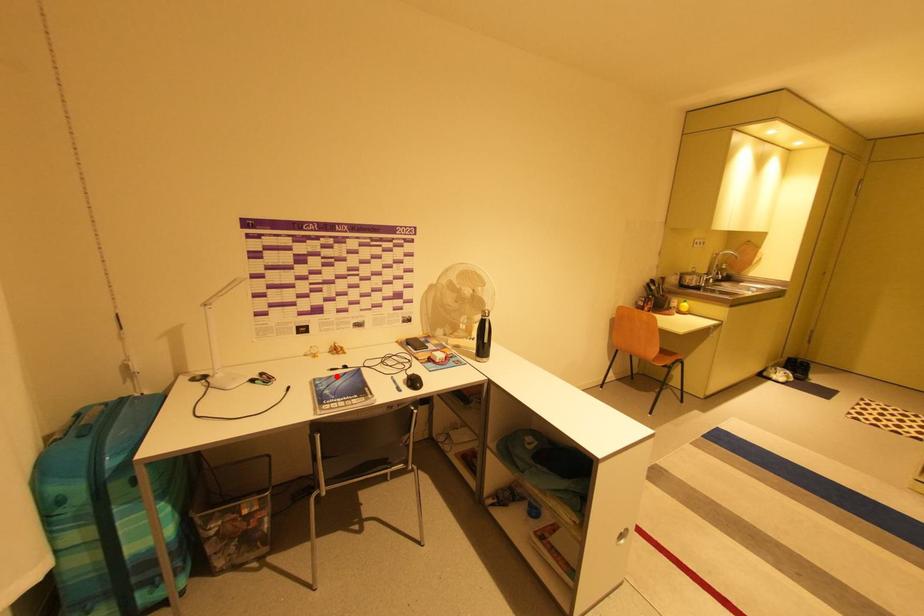
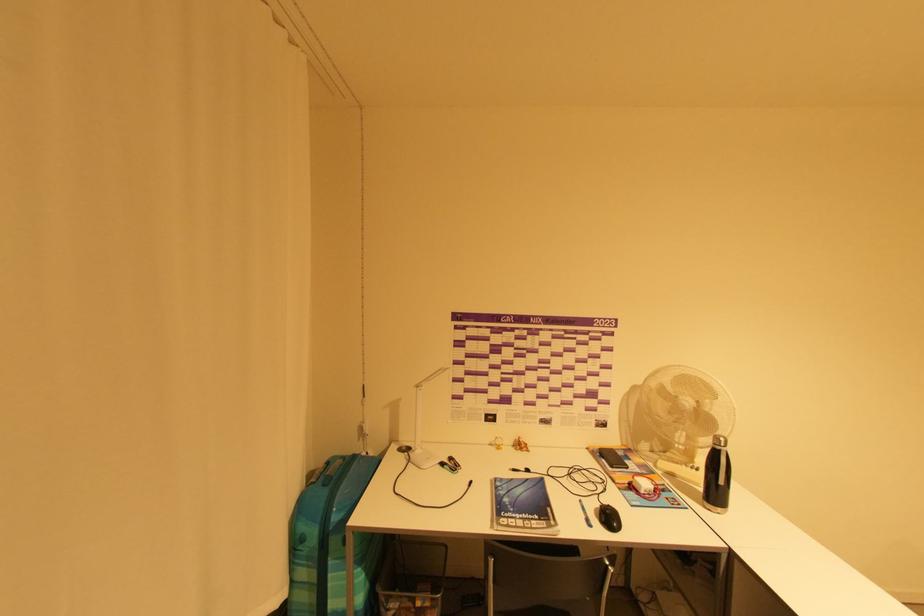
The point at the highlighted location is marked in the first image. Where is the corresponding point in the second image?

(517, 480)